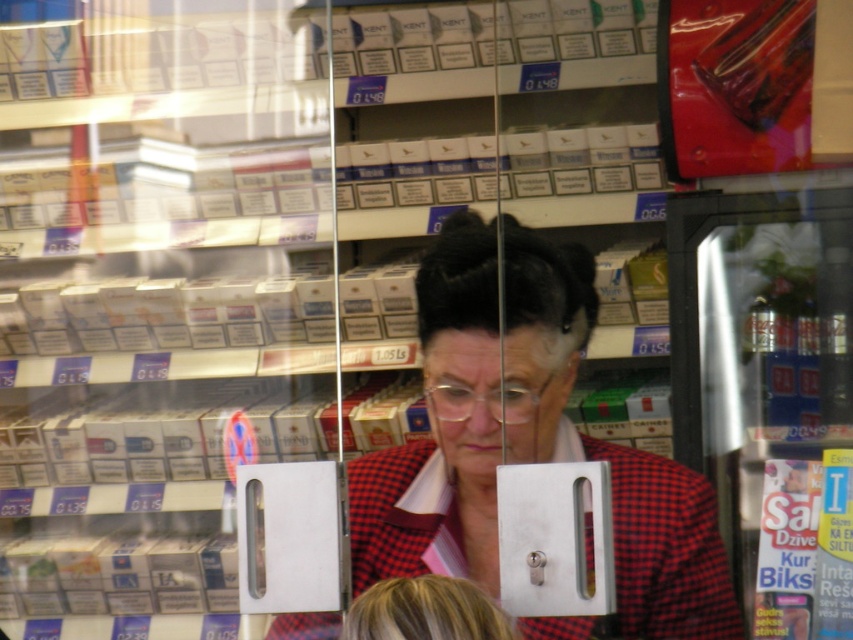
Is red plaid blazer at center smaller than blonde hair at lower center?

No.

Which is behind, point (537, 378) or point (379, 618)?

Point (537, 378)

Where is `red plaid blazer at center`? red plaid blazer at center is located at coordinates (526, 440).